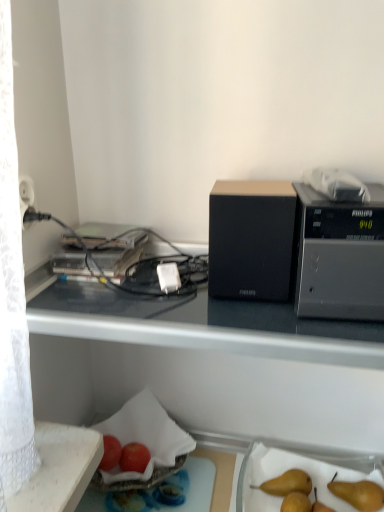
Where is `free space behind white plastic power plug at center`? free space behind white plastic power plug at center is located at coordinates (169, 262).